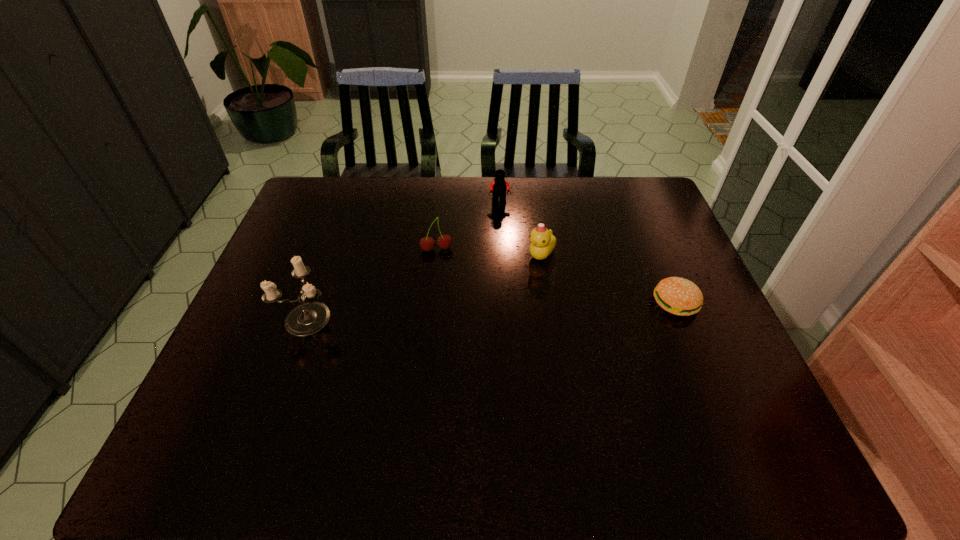
You are a GUI agent. You are given a task and a screenshot of the screen. Output one action in this format:
    pyautogui.click(x=<x>, y=<y>)
    Task: Click on the candle holder
    Image resolution: width=960 pixels, height=540 pixels.
    Given the screenshot: What is the action you would take?
    pyautogui.click(x=309, y=317)

At what (x,y) coordinates should I click in order to perform the action: click on the tallest object. Please return your answer as a coordinate pair (x, y). The width and height of the screenshot is (960, 540). Looking at the image, I should click on (309, 317).

This screenshot has height=540, width=960. I want to click on the rightmost object, so click(x=678, y=296).

You are a GUI agent. You are given a task and a screenshot of the screen. Output one action in this format:
    pyautogui.click(x=<x>, y=<y>)
    Task: Click on the patty
    
    Given the screenshot: What is the action you would take?
    pyautogui.click(x=678, y=296)

Identify the location of the third object from right to left. The width and height of the screenshot is (960, 540). (499, 186).

Identify the location of the farthest object. The image size is (960, 540). (499, 186).

The image size is (960, 540). Find the location of `the second object from left to right`. the second object from left to right is located at coordinates (427, 243).

This screenshot has height=540, width=960. What are the coordinates of `the second object from right to left` in the screenshot? It's located at (542, 240).

Find the location of a particular element. The image size is (960, 540). free region located on the back of the tallest object is located at coordinates (330, 256).

You are a GUI agent. You are given a task and a screenshot of the screen. Output one action in this format:
    pyautogui.click(x=<x>, y=<y>)
    Task: Click on the vacant space located on the left of the patty
    
    Given the screenshot: What is the action you would take?
    pyautogui.click(x=630, y=302)